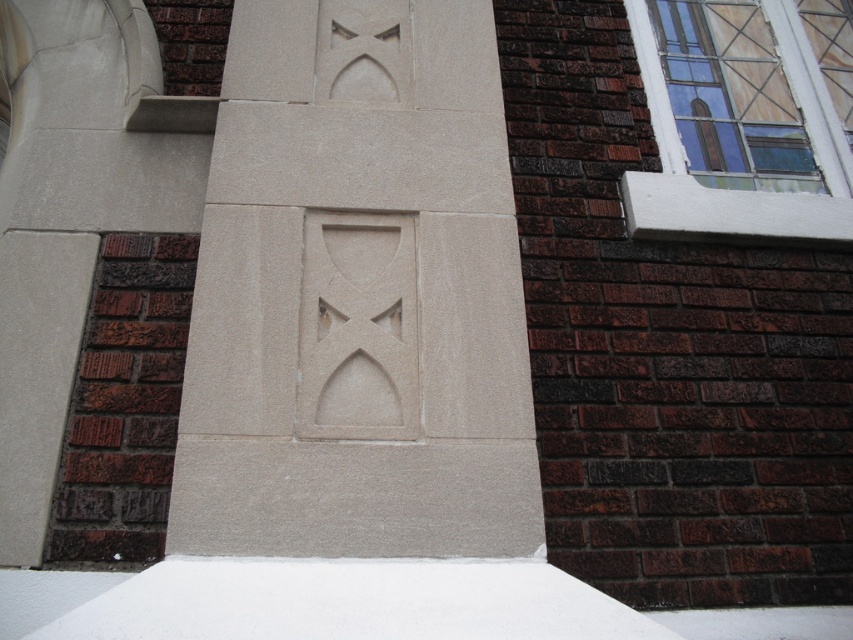
Can you confirm if clear glass window at upper right is smaller than white matte snow at bottom?

Actually, clear glass window at upper right might be larger than white matte snow at bottom.

Can you confirm if clear glass window at upper right is positioned above white matte snow at bottom?

Correct, clear glass window at upper right is located above white matte snow at bottom.

Identify the location of clear glass window at upper right. (740, 124).

In order to click on clear glass window at upper right in this screenshot , I will do `click(740, 124)`.

Is point (511, 237) farther from camera compared to point (285, 625)?

Yes, point (511, 237) is behind point (285, 625).

Locate an element on the screen. This screenshot has height=640, width=853. sanded stone carving at center is located at coordinates (358, 296).

Where is `sanded stone carving at center`? sanded stone carving at center is located at coordinates (358, 296).

Looking at this image, which is more to the right, sanded stone carving at center or clear glass window at upper right?

From the viewer's perspective, clear glass window at upper right appears more on the right side.

Does sanded stone carving at center appear under clear glass window at upper right?

Indeed, sanded stone carving at center is positioned under clear glass window at upper right.

What do you see at coordinates (358, 296) in the screenshot?
I see `sanded stone carving at center` at bounding box center [358, 296].

Locate an element on the screen. The width and height of the screenshot is (853, 640). sanded stone carving at center is located at coordinates (358, 296).